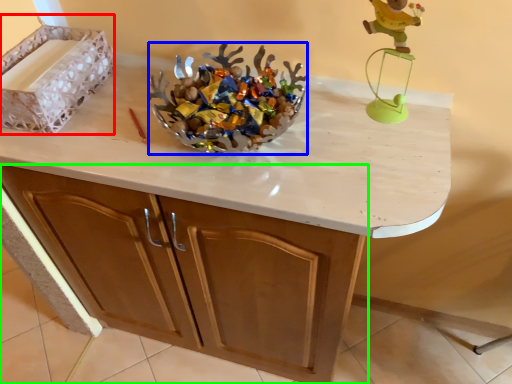
Question: Which is nearer to the crate (highlighted by a red box)? stuff (highlighted by a blue box) or cabinetry (highlighted by a green box).

Choices:
 (A) stuff
 (B) cabinetry

Answer: (A)